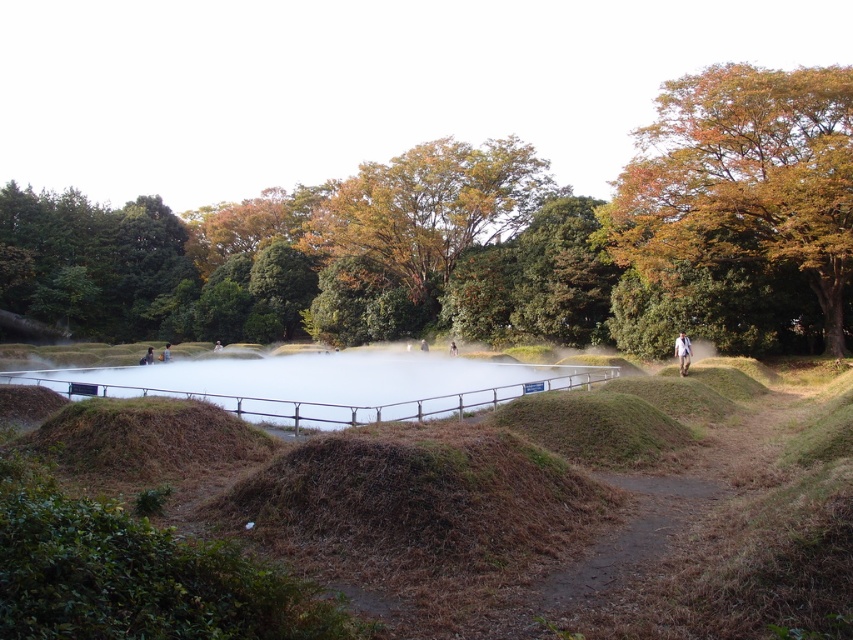
From the picture: You are a hiker trying to navigate through the park. You see the green leafy tree at upper center and the white mist at center. Which one is wider?

The green leafy tree at upper center is wider than the white mist at center.

You are a hiker trying to decide whether to take a photo with the green leafy tree at upper center and the brown grassy mound at center in the background. Will the tree be taller than the mound in the photo?

The green leafy tree at upper center is much taller than the brown grassy mound at center, so yes, the tree will appear taller than the mound in the photo.